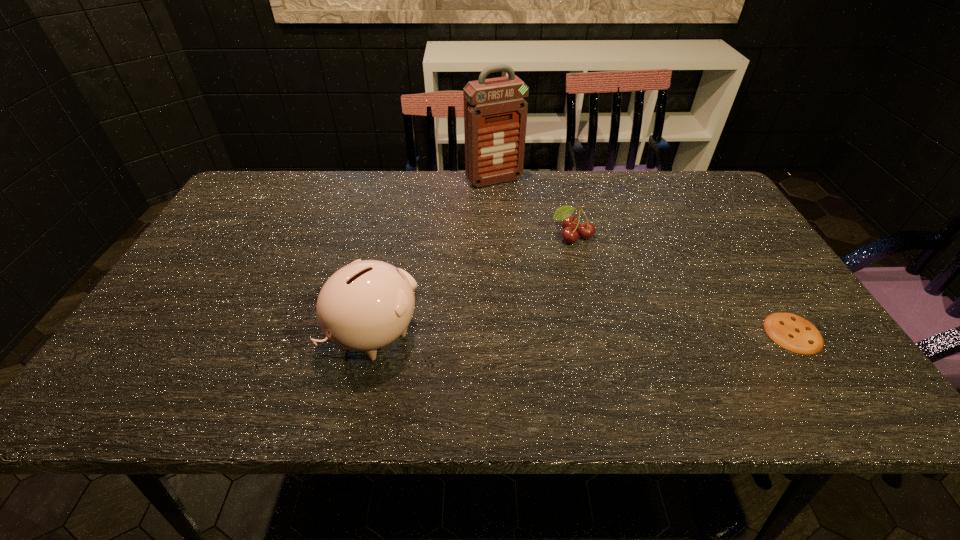
The height and width of the screenshot is (540, 960). I want to click on vacant position located 0.080m on the leaves of the third tallest object, so click(x=573, y=267).

Find the location of a particular element. free space located on the leaves of the third tallest object is located at coordinates (576, 310).

I want to click on free space located 0.090m on the leaves of the third tallest object, so click(x=573, y=269).

You are a GUI agent. You are given a task and a screenshot of the screen. Output one action in this format:
    pyautogui.click(x=<x>, y=<y>)
    Task: Click on the free space located 0.260m on the front-facing side of the second object from left to right
    This screenshot has width=960, height=540.
    Given the screenshot: What is the action you would take?
    (541, 238)

The image size is (960, 540). What are the coordinates of `free space located on the front-facing side of the second object from left to right` in the screenshot? It's located at (519, 208).

Where is `vacant space located on the front-facing side of the second object from left to right`? This screenshot has height=540, width=960. vacant space located on the front-facing side of the second object from left to right is located at coordinates click(511, 198).

Find the location of a particular element. The width and height of the screenshot is (960, 540). object present at the far edge is located at coordinates (495, 112).

Locate an element on the screen. Image resolution: width=960 pixels, height=540 pixels. piggy bank that is at the near edge is located at coordinates (366, 305).

Image resolution: width=960 pixels, height=540 pixels. I want to click on cookie that is at the near edge, so click(x=792, y=332).

Identify the location of object at the right edge. The height and width of the screenshot is (540, 960). (792, 332).